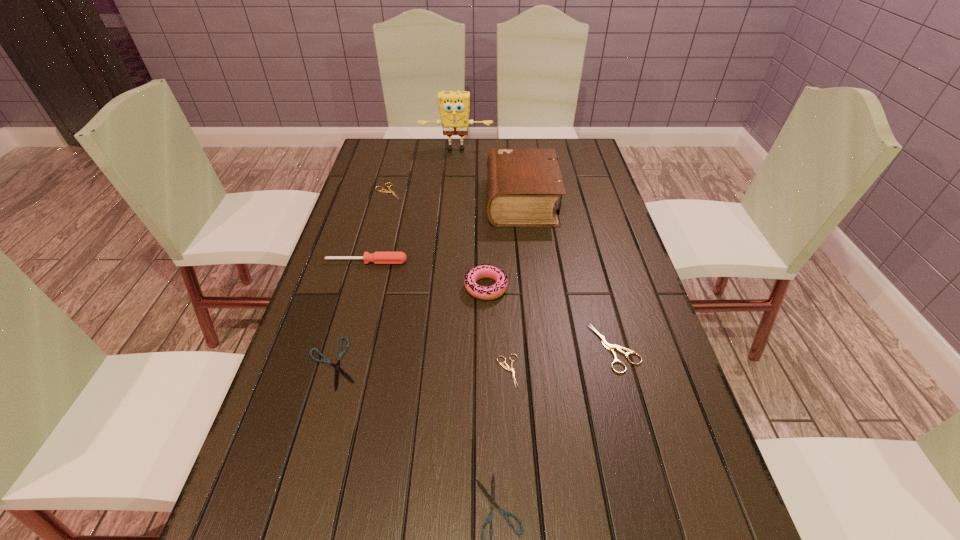
In the image, there is a desktop. Identify the location of vacant space at the far right corner. (588, 150).

Identify the location of vacant area that lies between the doughnut and the tallest object. This screenshot has height=540, width=960. (471, 219).

You are a GUI agent. You are given a task and a screenshot of the screen. Output one action in this format:
    pyautogui.click(x=<x>, y=<y>)
    Task: Click on the free space between the Bible and the fourth shortest shears
    The image size is (960, 540).
    Given the screenshot: What is the action you would take?
    pyautogui.click(x=455, y=197)

I want to click on empty location between the rightmost shears and the screwdriver, so click(x=491, y=305).

Identify the location of empty space between the tallest shears and the Bible. (568, 274).

I want to click on free space between the eighth shortest object and the smallest beige shears, so click(515, 286).

Where is `blank region between the farthest object and the smallest beige shears`? The height and width of the screenshot is (540, 960). blank region between the farthest object and the smallest beige shears is located at coordinates pos(482,260).

Where is `object that is the sixth closest to the farthest shears`? Image resolution: width=960 pixels, height=540 pixels. object that is the sixth closest to the farthest shears is located at coordinates coord(506,367).

Identify which object is located as the nearest to the left black shears. Please provide its 2D coordinates. Your answer should be formatted as a tuple, i.e. [(x, y)], where the tuple contains the x and y coordinates of a point satisfying the conditions above.

[(377, 257)]

Find the location of a particular element. shears that can be found as the closest to the second tallest object is located at coordinates (382, 190).